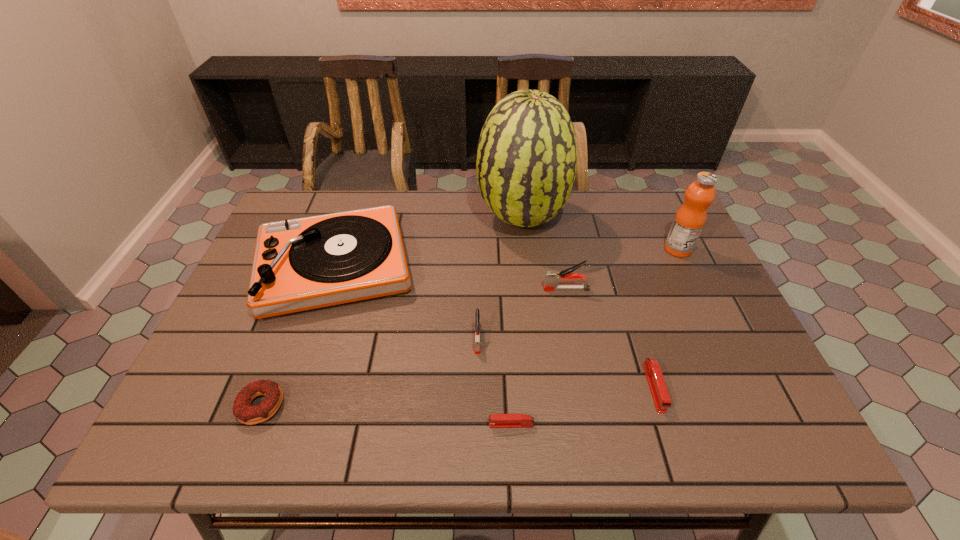
Locate an element on the screen. vacant area that lies between the nearer red stapler and the tallest object is located at coordinates (516, 321).

Where is `vacant region between the second nearest stapler and the tallest object`? This screenshot has height=540, width=960. vacant region between the second nearest stapler and the tallest object is located at coordinates (588, 303).

Locate an element on the screen. free space between the rightmost object and the third shortest stapler is located at coordinates (578, 294).

The image size is (960, 540). Find the location of `free space between the fifth tallest object and the fruit juice`. free space between the fifth tallest object and the fruit juice is located at coordinates (578, 294).

Identify the location of empty space between the farther red stapler and the green watermelon. The height and width of the screenshot is (540, 960). (588, 303).

The width and height of the screenshot is (960, 540). I want to click on free spot between the fruit juice and the second object from right to left, so click(x=666, y=319).

Identify the location of free space between the rightmost stapler and the doughnut. Image resolution: width=960 pixels, height=540 pixels. (458, 397).

Locate an element on the screen. The height and width of the screenshot is (540, 960). free space between the tallest stapler and the fruit juice is located at coordinates (622, 269).

The height and width of the screenshot is (540, 960). I want to click on vacant area between the leftmost stapler and the record player, so click(406, 302).

Locate an element on the screen. The width and height of the screenshot is (960, 540). free space that is in between the second nearest stapler and the second stapler from right to left is located at coordinates (611, 339).